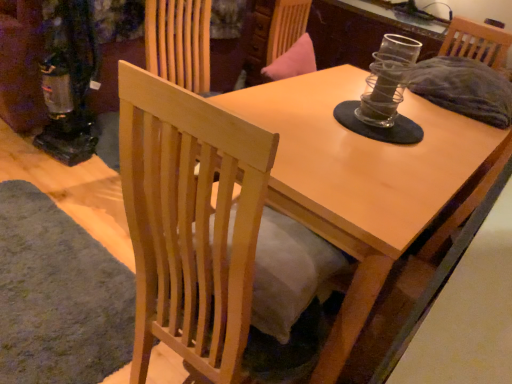
Question: Visually, is light wood table at center positioned to the left or to the right of natural wood chair at center?

Choices:
 (A) left
 (B) right

Answer: (B)

Question: Does point [x=329, y=97] appear closer or farther from the camera than point [x=247, y=306]?

Choices:
 (A) closer
 (B) farther

Answer: (B)

Question: Estimate the real-world distances between objects in this image. Which object is closer to the natural wood chair at center?

Choices:
 (A) soft gray carpet at lower left
 (B) light wood table at center

Answer: (B)

Question: Which object is the farthest from the natural wood chair at center?

Choices:
 (A) light wood table at center
 (B) soft gray carpet at lower left

Answer: (B)